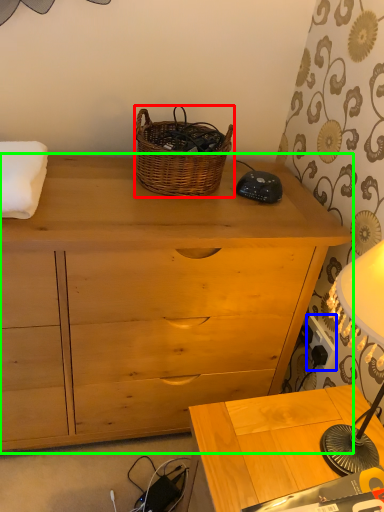
Question: Which object is positioned closest to picnic basket (highlighted by a red box)? Select from power outlet (highlighted by a blue box) and chest of drawers (highlighted by a green box).

Choices:
 (A) power outlet
 (B) chest of drawers

Answer: (B)